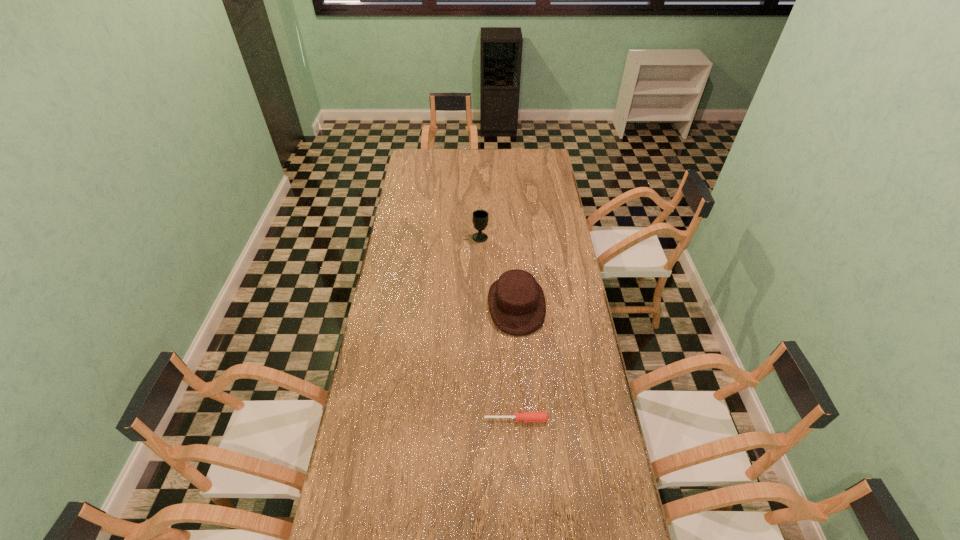
Locate an element on the screen. vacant region at the right edge of the desktop is located at coordinates (575, 314).

Identify the location of free region at the far left corner. (424, 150).

Locate an element on the screen. vacant space at the far right corner is located at coordinates (534, 158).

Where is `vacant area that lies between the nearest object and the second farthest object`? The height and width of the screenshot is (540, 960). vacant area that lies between the nearest object and the second farthest object is located at coordinates (516, 362).

Identify the location of free point between the chalice and the hat. Image resolution: width=960 pixels, height=540 pixels. (498, 271).

At what (x,y) coordinates should I click in order to perform the action: click on free point between the shortest object and the farthest object. Please return your answer as a coordinate pair (x, y). Looking at the image, I should click on (498, 328).

Find the location of `empty space that is in between the farthest object and the second nearest object`. empty space that is in between the farthest object and the second nearest object is located at coordinates (498, 271).

Identify the location of vacant area that lies between the tallest object and the second farthest object. (498, 271).

Point out which object is positioned as the nearest to the screwdriver. Please provide its 2D coordinates. Your answer should be formatted as a tuple, i.e. [(x, y)], where the tuple contains the x and y coordinates of a point satisfying the conditions above.

[(516, 301)]

I want to click on the closest object to the farthest object, so click(x=516, y=301).